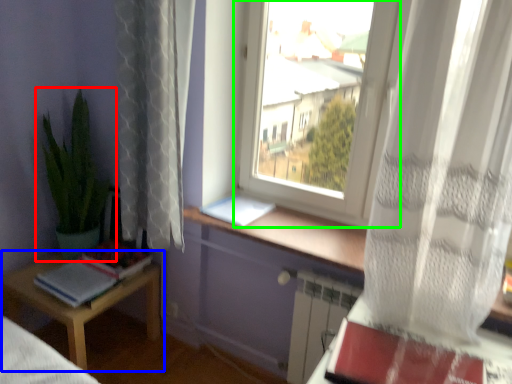
Question: Based on their relative distances, which object is farther from houseplant (highlighted by a red box)? Choose from table (highlighted by a blue box) and window (highlighted by a green box).

Choices:
 (A) table
 (B) window

Answer: (B)